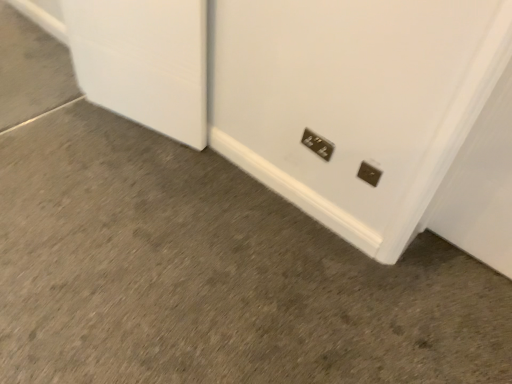
Question: Is metallic silver power plug at lower right, the 1th power plugs and sockets viewed from the right, positioned far away from metallic silver power plugs and sockets at lower center, positioned as the first power plugs and sockets in top-to-bottom order?

Choices:
 (A) yes
 (B) no

Answer: (B)

Question: Is metallic silver power plug at lower right, the 1th power plugs and sockets viewed from the right, at the right side of metallic silver power plugs and sockets at lower center, the 2th power plugs and sockets in the front-to-back sequence?

Choices:
 (A) yes
 (B) no

Answer: (A)

Question: From a real-world perspective, does metallic silver power plug at lower right, the 1th power plugs and sockets viewed from the right, stand above metallic silver power plugs and sockets at lower center, the 2th power plugs and sockets in the bottom-to-top sequence?

Choices:
 (A) no
 (B) yes

Answer: (B)

Question: Does metallic silver power plug at lower right, arranged as the first power plugs and sockets when ordered from the bottom, have a larger size compared to metallic silver power plugs and sockets at lower center, the 2th power plugs and sockets in the front-to-back sequence?

Choices:
 (A) no
 (B) yes

Answer: (A)

Question: Is metallic silver power plug at lower right, the 1th power plugs and sockets viewed from the right, positioned beyond the bounds of metallic silver power plugs and sockets at lower center, which ranks as the second power plugs and sockets in right-to-left order?

Choices:
 (A) yes
 (B) no

Answer: (A)

Question: Can you confirm if metallic silver power plug at lower right, the 1th power plugs and sockets viewed from the right, is smaller than metallic silver power plugs and sockets at lower center, the 2th power plugs and sockets in the front-to-back sequence?

Choices:
 (A) yes
 (B) no

Answer: (A)

Question: Is metallic silver power plugs and sockets at lower center, positioned as the first power plugs and sockets in top-to-bottom order, oriented away from metallic silver power plug at lower right, positioned as the second power plugs and sockets in left-to-right order?

Choices:
 (A) yes
 (B) no

Answer: (B)

Question: Does metallic silver power plugs and sockets at lower center, which is the first power plugs and sockets from left to right, have a lesser width compared to metallic silver power plug at lower right, which is counted as the 2th power plugs and sockets, starting from the top?

Choices:
 (A) yes
 (B) no

Answer: (B)

Question: From the image's perspective, does metallic silver power plugs and sockets at lower center, the 2th power plugs and sockets in the front-to-back sequence, appear higher than metallic silver power plug at lower right, which is counted as the 2th power plugs and sockets, starting from the top?

Choices:
 (A) no
 (B) yes

Answer: (B)

Question: Is metallic silver power plugs and sockets at lower center, the 2th power plugs and sockets in the bottom-to-top sequence, at the left side of metallic silver power plug at lower right, the 2th power plugs and sockets in the back-to-front sequence?

Choices:
 (A) yes
 (B) no

Answer: (A)

Question: Can metallic silver power plug at lower right, arranged as the first power plugs and sockets when ordered from the bottom, be found inside metallic silver power plugs and sockets at lower center, which is the first power plugs and sockets from back to front?

Choices:
 (A) yes
 (B) no

Answer: (B)

Question: From a real-world perspective, is metallic silver power plugs and sockets at lower center, positioned as the first power plugs and sockets in top-to-bottom order, located higher than metallic silver power plug at lower right, which is counted as the 2th power plugs and sockets, starting from the top?

Choices:
 (A) yes
 (B) no

Answer: (B)

Question: In the image, is metallic silver power plugs and sockets at lower center, which is the first power plugs and sockets from back to front, positioned in front of or behind metallic silver power plug at lower right, positioned as the second power plugs and sockets in left-to-right order?

Choices:
 (A) behind
 (B) front

Answer: (A)